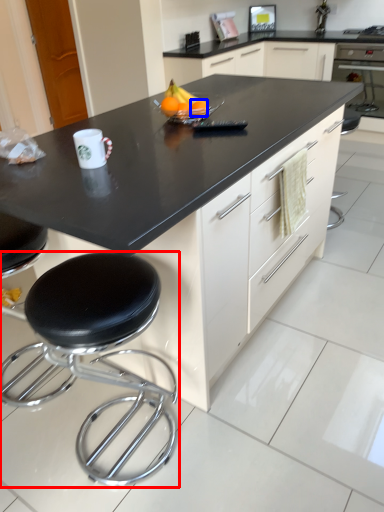
Question: Which object appears farthest to the camera in this image, stool (highlighted by a red box) or orange (highlighted by a blue box)?

Choices:
 (A) stool
 (B) orange

Answer: (B)